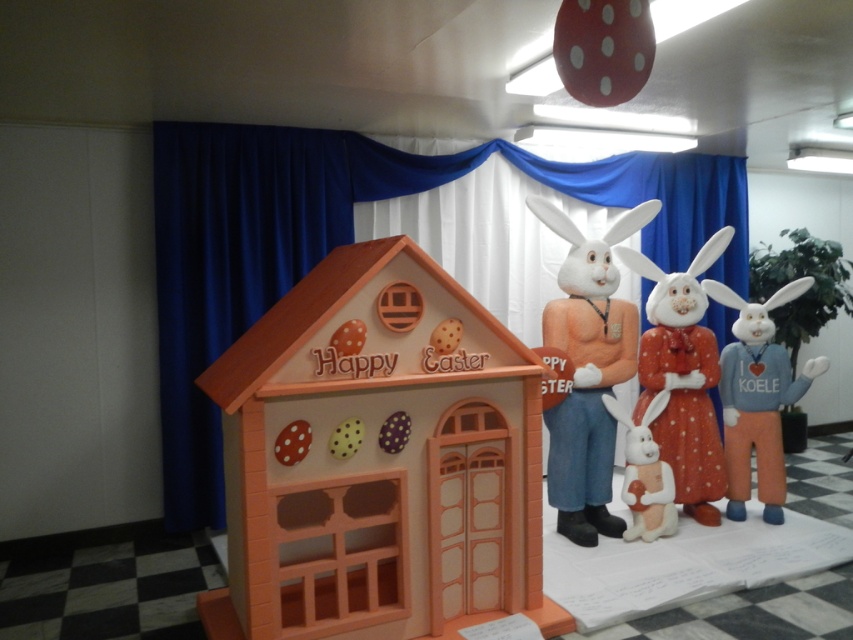
You are setting up an Easter display and want to place a small decoration between the white plush rabbit at center and the white matte plush at center. Since the rabbit is taller, where should you place the decoration to ensure it is visible from the front?

Place the decoration in front of the white plush rabbit at center because it is taller than the white matte plush at center, so positioning it in front of the taller rabbit ensures visibility from the front.

Based on the photo, you are standing in front of the Easter display and want to place a small decoration between the two points marked as point (795, 296) and point (666, 492). Which point is closer to you so you can start placing the decoration there?

Point (795, 296) is further to the viewer than point (666, 492). Therefore, point (666, 492) is closer to you, so you should start placing the decoration near that point.

You are standing at the entrance of the matte orange house at center and want to place a new Easter decoration 2.5 meters away from it. Can you safely place it without exceeding the recommended distance? Please explain.

The recommended distance is 2.61 meters. Since 2.5 meters is less than 2.61 meters, placing the decoration 2.5 meters away from the matte orange house at center is within the safe distance and acceptable.